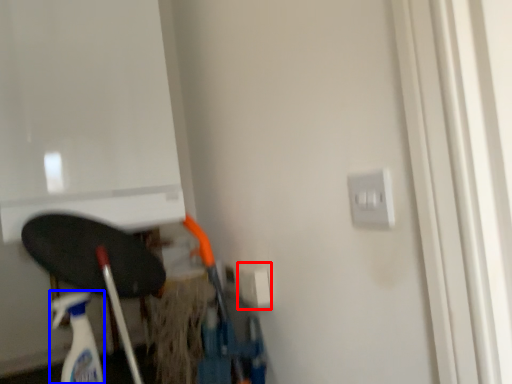
Question: Which of the following is the farthest to the observer, electric outlet (highlighted by a red box) or cleaning product (highlighted by a blue box)?

Choices:
 (A) electric outlet
 (B) cleaning product

Answer: (A)